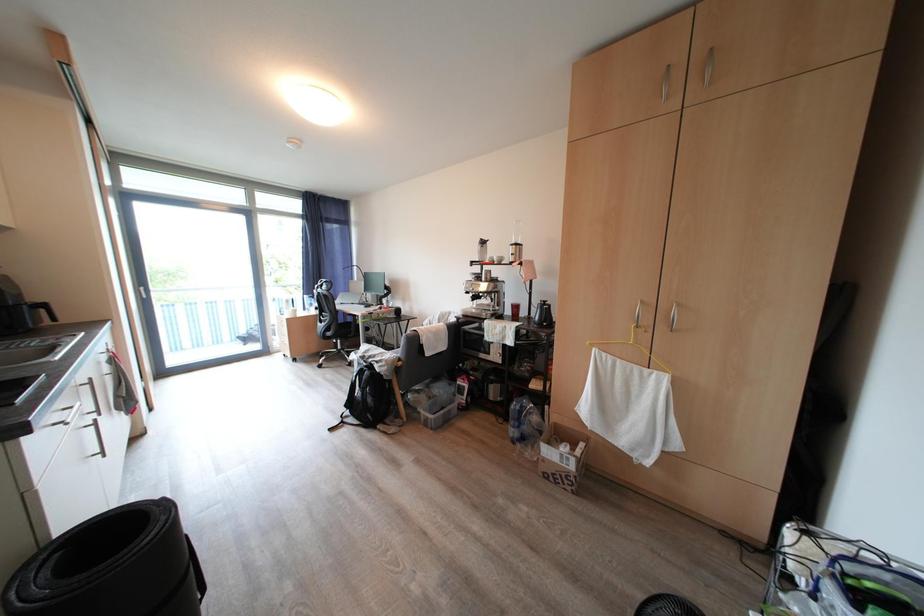
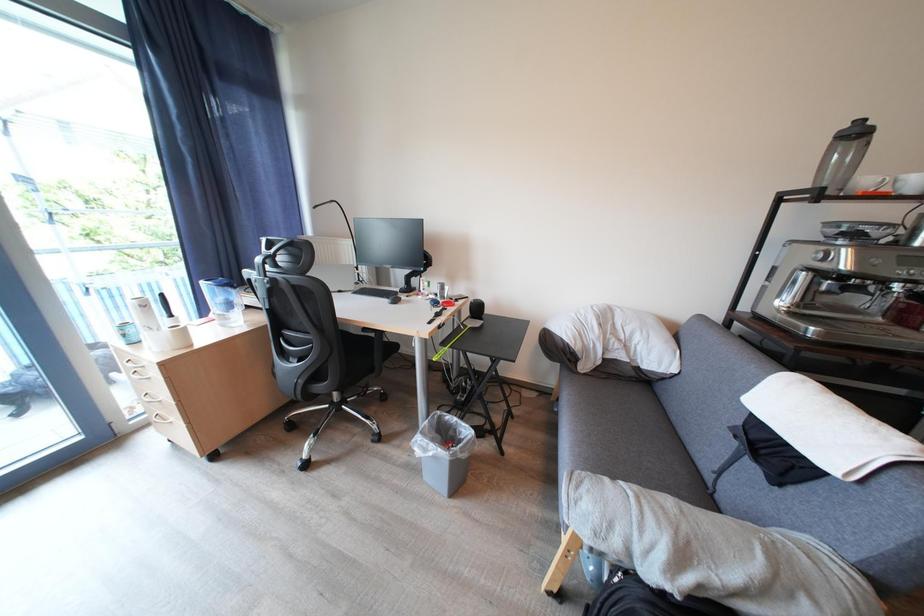
In a continuous first-person perspective shot, in which direction is the camera moving?

The movement direction of the cameraman is left, forward.